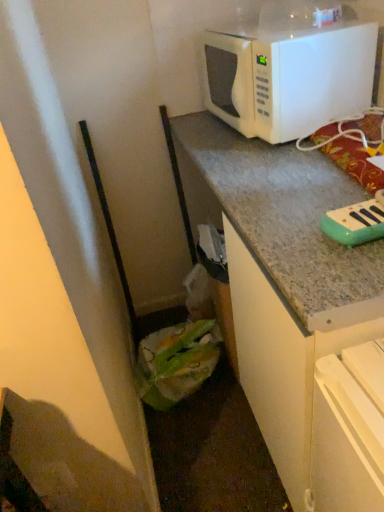
Question: Can green plastic bag at lower left be found inside white matte microwave at upper right?

Choices:
 (A) yes
 (B) no

Answer: (B)

Question: Considering the relative sizes of white matte microwave at upper right and green plastic bag at lower left in the image provided, is white matte microwave at upper right bigger than green plastic bag at lower left?

Choices:
 (A) yes
 (B) no

Answer: (A)

Question: Does white matte microwave at upper right lie in front of green plastic bag at lower left?

Choices:
 (A) no
 (B) yes

Answer: (B)

Question: From a real-world perspective, is white matte microwave at upper right on green plastic bag at lower left?

Choices:
 (A) yes
 (B) no

Answer: (A)

Question: Could you tell me if white matte microwave at upper right is facing green plastic bag at lower left?

Choices:
 (A) no
 (B) yes

Answer: (A)

Question: Does white matte microwave at upper right lie behind green plastic bag at lower left?

Choices:
 (A) no
 (B) yes

Answer: (A)

Question: Could you tell me if green plastic bag at lower left is turned towards teal plastic toy piano at upper right?

Choices:
 (A) no
 (B) yes

Answer: (A)

Question: From a real-world perspective, is green plastic bag at lower left physically below teal plastic toy piano at upper right?

Choices:
 (A) yes
 (B) no

Answer: (A)

Question: Can you confirm if green plastic bag at lower left is wider than teal plastic toy piano at upper right?

Choices:
 (A) yes
 (B) no

Answer: (A)

Question: Can you confirm if green plastic bag at lower left is thinner than teal plastic toy piano at upper right?

Choices:
 (A) no
 (B) yes

Answer: (A)

Question: Is green plastic bag at lower left not inside teal plastic toy piano at upper right?

Choices:
 (A) yes
 (B) no

Answer: (A)

Question: From the image's perspective, does green plastic bag at lower left appear higher than teal plastic toy piano at upper right?

Choices:
 (A) yes
 (B) no

Answer: (B)

Question: Does green plastic bag at lower left have a greater height compared to white matte microwave at upper right?

Choices:
 (A) yes
 (B) no

Answer: (B)